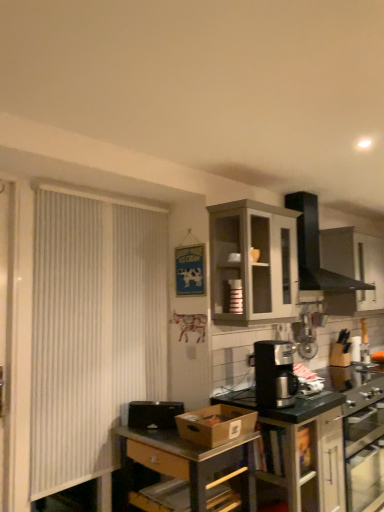
Question: Is metallic gray table at center to the right of white textured screen door at left from the viewer's perspective?

Choices:
 (A) yes
 (B) no

Answer: (A)

Question: Can white textured screen door at left be found inside metallic gray table at center?

Choices:
 (A) yes
 (B) no

Answer: (B)

Question: Considering the relative sizes of metallic gray table at center and white textured screen door at left in the image provided, is metallic gray table at center taller than white textured screen door at left?

Choices:
 (A) no
 (B) yes

Answer: (A)

Question: Does metallic gray table at center have a greater width compared to white textured screen door at left?

Choices:
 (A) no
 (B) yes

Answer: (B)

Question: From the image's perspective, is metallic gray table at center under white textured screen door at left?

Choices:
 (A) no
 (B) yes

Answer: (B)

Question: Is metallic gray table at center bigger than white textured screen door at left?

Choices:
 (A) no
 (B) yes

Answer: (B)

Question: Is metallic gray table at center at the right side of matte gray cabinet at upper center, the 1th cabinetry in the top-to-bottom sequence?

Choices:
 (A) yes
 (B) no

Answer: (B)

Question: Considering the relative sizes of metallic gray table at center and matte gray cabinet at upper center, the 1th cabinetry in the top-to-bottom sequence, in the image provided, is metallic gray table at center taller than matte gray cabinet at upper center, the 1th cabinetry in the top-to-bottom sequence,?

Choices:
 (A) no
 (B) yes

Answer: (A)

Question: From a real-world perspective, is metallic gray table at center under matte gray cabinet at upper center, the 1th cabinetry in the top-to-bottom sequence?

Choices:
 (A) yes
 (B) no

Answer: (A)

Question: From the image's perspective, is metallic gray table at center beneath matte gray cabinet at upper center, the second cabinetry positioned from the bottom?

Choices:
 (A) no
 (B) yes

Answer: (B)

Question: Is metallic gray table at center in contact with matte gray cabinet at upper center, the second cabinetry positioned from the bottom?

Choices:
 (A) no
 (B) yes

Answer: (A)

Question: Can you confirm if metallic gray table at center is thinner than matte gray cabinet at upper center, the 1th cabinetry in the top-to-bottom sequence?

Choices:
 (A) yes
 (B) no

Answer: (B)

Question: Is black plastic coffee maker at center further to camera compared to black matte vent at upper center?

Choices:
 (A) yes
 (B) no

Answer: (B)